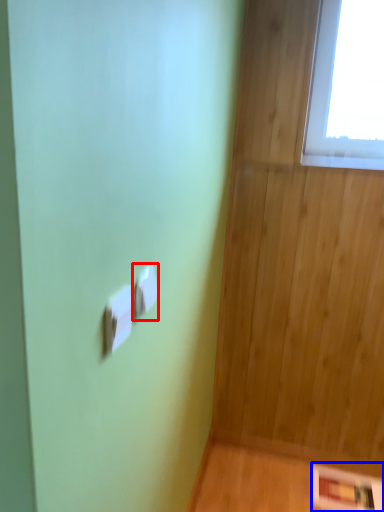
Question: Which point is further to the camera, light switch (highlighted by a red box) or panel (highlighted by a blue box)?

Choices:
 (A) light switch
 (B) panel

Answer: (B)